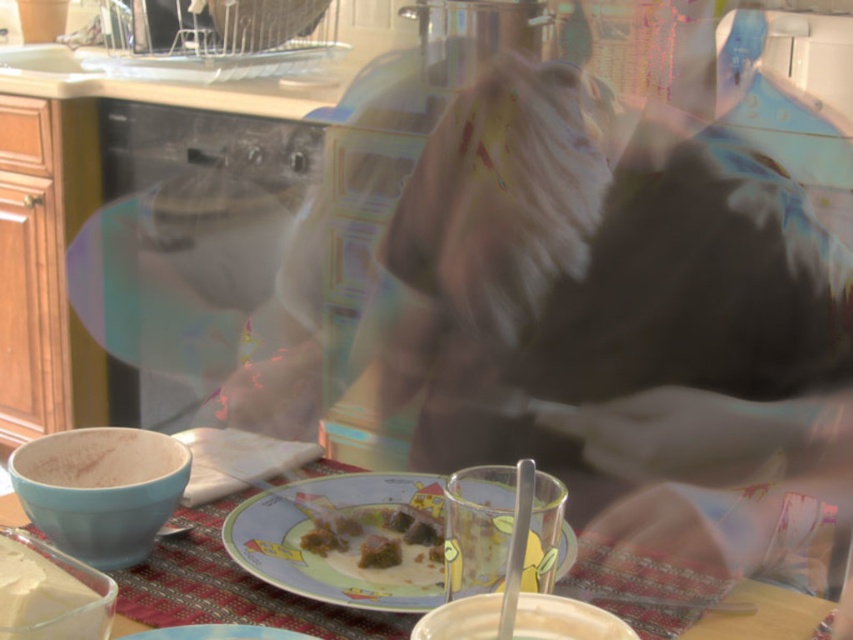
Which is more to the left, decorative ceramic plate at center or smooth white cake at lower left?

smooth white cake at lower left

Is decorative ceramic plate at center positioned behind smooth white cake at lower left?

Yes.

Is point (440, 573) positioned after point (16, 561)?

Yes.

You are a GUI agent. You are given a task and a screenshot of the screen. Output one action in this format:
    pyautogui.click(x=<x>, y=<y>)
    Task: Click on the decorative ceramic plate at center
    
    Given the screenshot: What is the action you would take?
    pyautogui.click(x=329, y=556)

Is point (461, 532) more distant than point (57, 600)?

That is True.

Which is above, dark brown cake at center or smooth white cake at lower left?

smooth white cake at lower left is higher up.

Is point (364, 541) in front of point (109, 589)?

No, (364, 541) is further to viewer.

Locate an element on the screen. The width and height of the screenshot is (853, 640). dark brown cake at center is located at coordinates (401, 541).

Who is more forward, (x=340, y=544) or (x=711, y=612)?

Point (x=711, y=612) is more forward.

Identify the location of dark brown cake at center. (401, 541).

Who is more forward, (x=502, y=516) or (x=113, y=632)?

Point (x=502, y=516) is in front.

I want to click on dark brown cake at center, so click(401, 541).